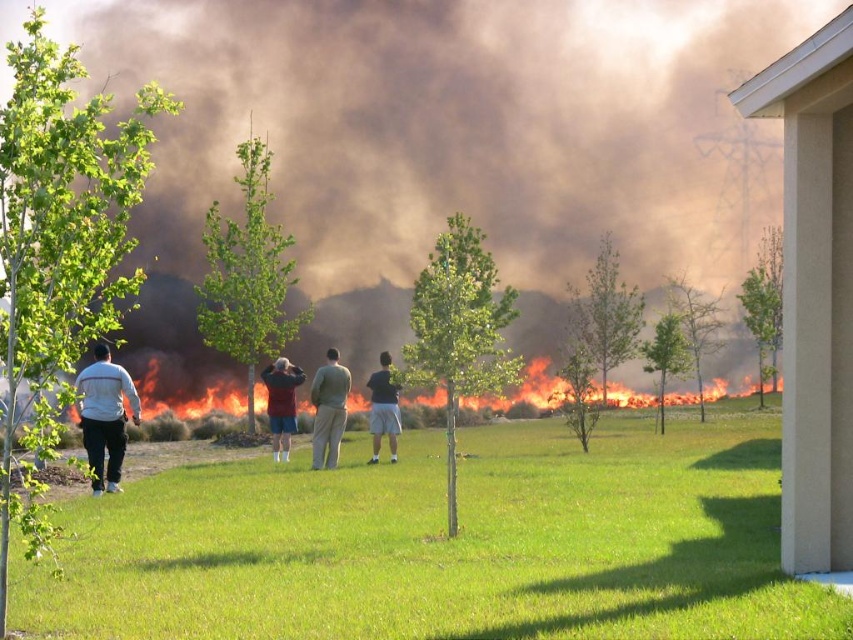
Question: Which point is closer to the camera?

Choices:
 (A) (114, 364)
 (B) (524, 440)
 (C) (318, 432)

Answer: (C)

Question: Does green grass at center have a larger size compared to white matte pants at left?

Choices:
 (A) yes
 (B) no

Answer: (A)

Question: Is green grass at center to the right of flaming orange flames at center from the viewer's perspective?

Choices:
 (A) yes
 (B) no

Answer: (A)

Question: Estimate the real-world distances between objects in this image. Which object is farther from the flaming orange flames at center?

Choices:
 (A) green grass at center
 (B) maroon fabric shirt at center
 (C) white matte pants at left
 (D) dark gray shorts at center

Answer: (B)

Question: Which object appears farthest from the camera in this image?

Choices:
 (A) tan pants at center
 (B) white matte pants at left
 (C) brown smoke at center

Answer: (C)

Question: Does green grass at center have a greater width compared to tan pants at center?

Choices:
 (A) no
 (B) yes

Answer: (B)